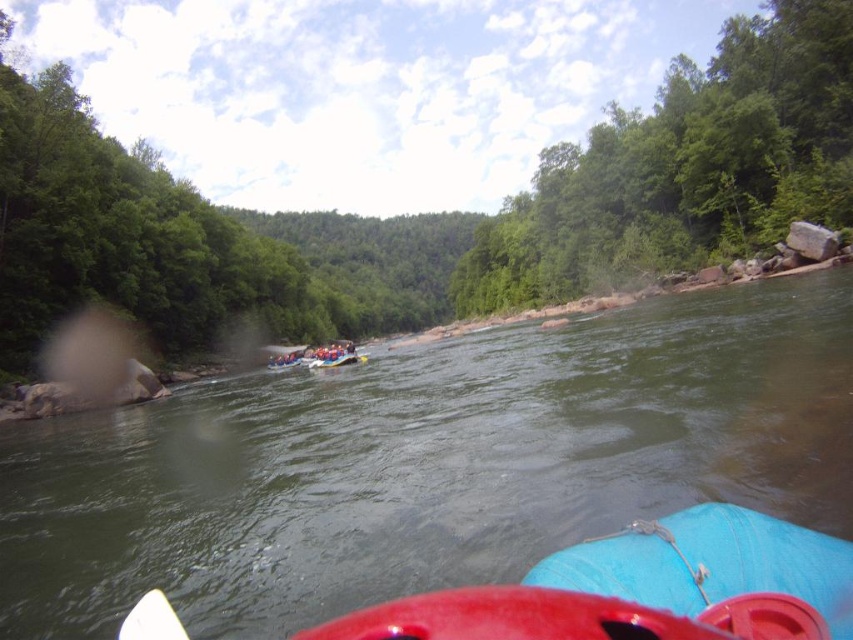
Question: Does green rubber raft at center have a smaller size compared to white rubber raft at center?

Choices:
 (A) yes
 (B) no

Answer: (B)

Question: In this image, where is blue rubber canoe at lower right located relative to white rubber raft at center?

Choices:
 (A) right
 (B) left

Answer: (A)

Question: Estimate the real-world distances between objects in this image. Which object is farther from the white rubber raft at center?

Choices:
 (A) blue rubber canoe at lower right
 (B) green rubber raft at center
 (C) white plastic paddle at lower center

Answer: (A)

Question: Which point is farther to the camera?

Choices:
 (A) (142, 605)
 (B) (712, 536)
 (C) (318, 364)
 (D) (437, 404)

Answer: (C)

Question: Which object is the closest to the white rubber raft at center?

Choices:
 (A) green rubber raft at center
 (B) white plastic paddle at lower center
 (C) blue rubber canoe at lower right

Answer: (A)

Question: Can you confirm if blue rubber canoe at lower right is thinner than white plastic paddle at lower center?

Choices:
 (A) yes
 (B) no

Answer: (B)